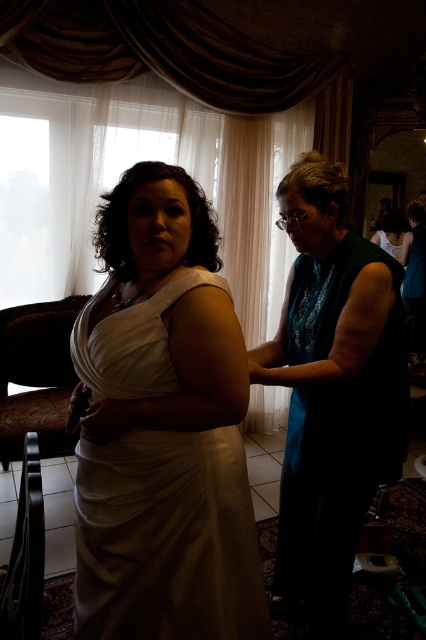
You are standing in the preparation area and want to take a photo. There are two points marked in the scene, point 1 at coordinates point (149,333) and point 2 at coordinates point (129,8). Which point will appear larger in your photo?

Point (149,333) is closer to the camera than point (129,8), so it will appear larger in the photo.